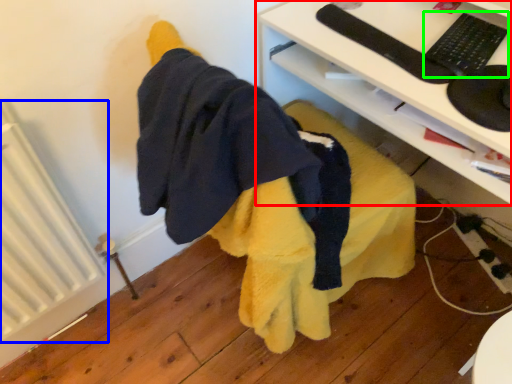
Question: Estimate the real-world distances between objects in this image. Which object is farther from desk (highlighted by a red box), radiator (highlighted by a blue box) or keyboard (highlighted by a green box)?

Choices:
 (A) radiator
 (B) keyboard

Answer: (A)